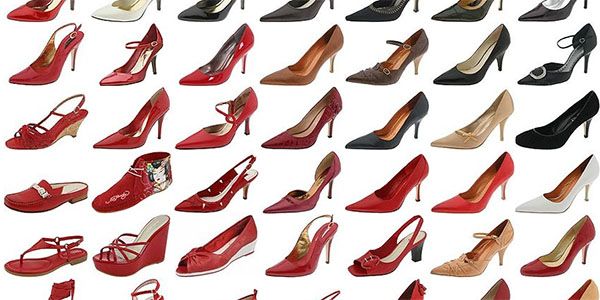
This screenshot has width=600, height=300. I want to click on 4th row of shoes in image, so click(31, 195), click(115, 194), click(212, 197), click(290, 201), click(379, 200), click(450, 201), click(541, 197).